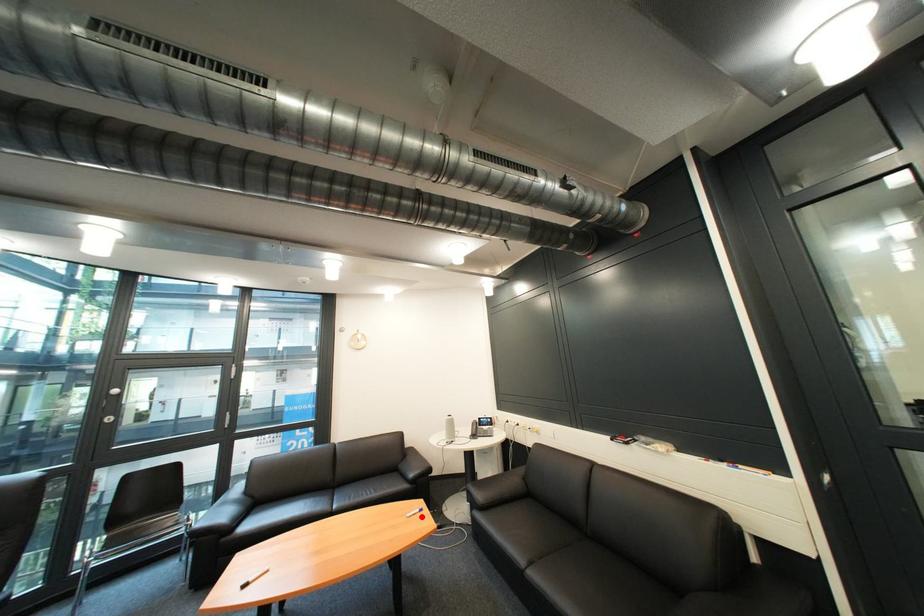
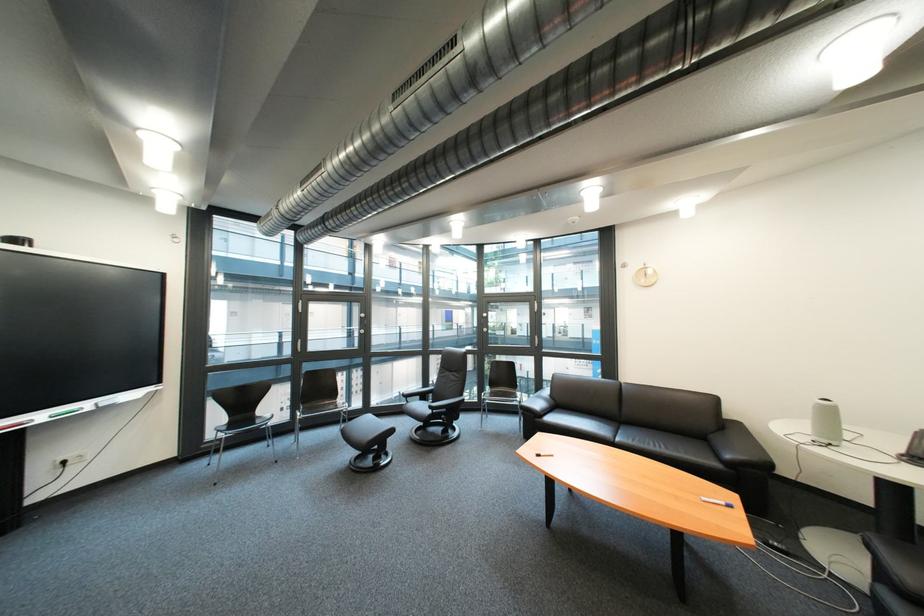
In the second image, find the point that corresponds to the highlighted location in the first image.

(718, 501)